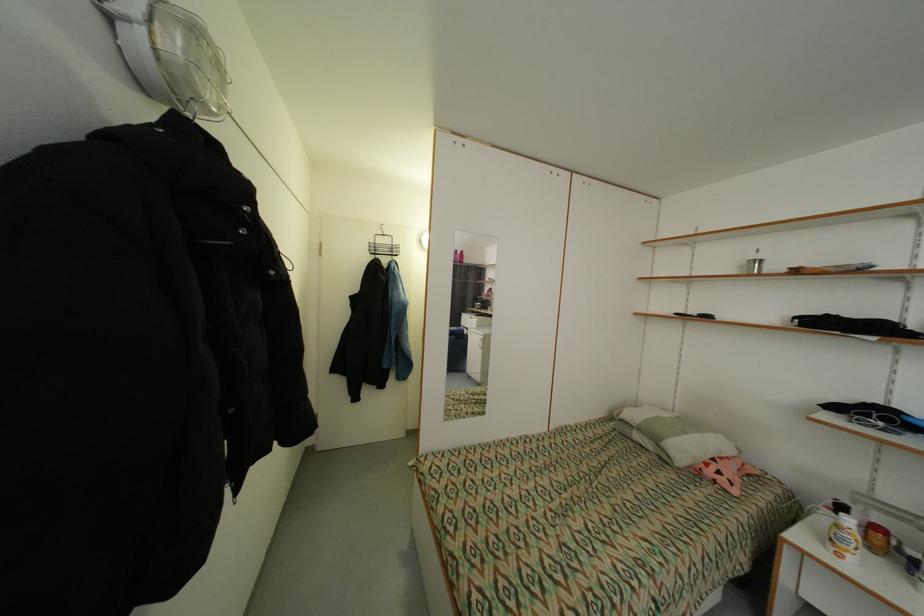
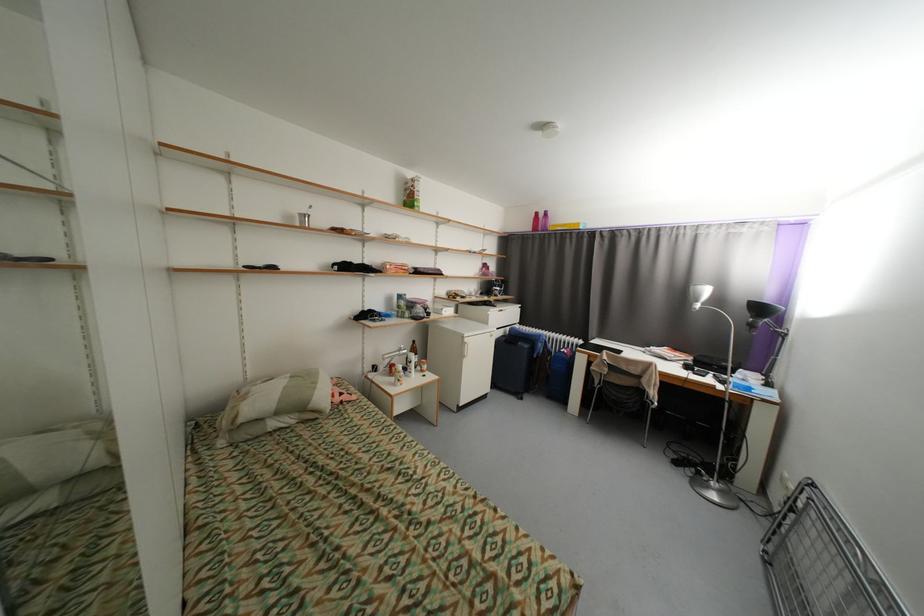
The point at [690,434] is marked in the first image. Where is the corresponding point in the second image?

(322, 384)